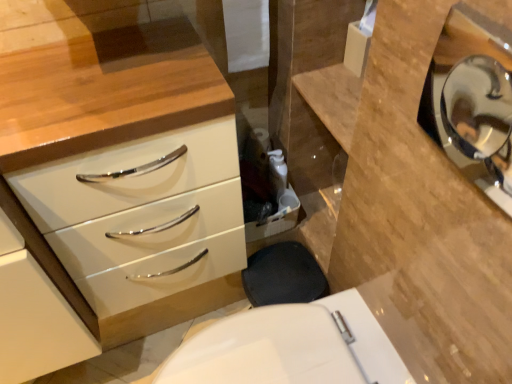
Measure the distance between white glossy toilet at lower center and camera.

white glossy toilet at lower center and camera are 31.50 inches apart from each other.

Locate an element on the screen. The width and height of the screenshot is (512, 384). white glossy chest of drawers at left is located at coordinates (123, 156).

At what (x,y) coordinates should I click in order to perform the action: click on white glossy toilet at lower center. Please return your answer as a coordinate pair (x, y). The height and width of the screenshot is (384, 512). Looking at the image, I should click on (291, 347).

From the image's perspective, which object appears higher, white glossy chest of drawers at left or white glossy toilet at lower center?

white glossy chest of drawers at left, from the image's perspective.

Which of these two, white glossy chest of drawers at left or white glossy toilet at lower center, stands shorter?

white glossy toilet at lower center is shorter.

Is white glossy chest of drawers at left further to camera compared to white glossy toilet at lower center?

No, it is not.

Is white glossy chest of drawers at left inside or outside of white glossy toilet at lower center?

white glossy chest of drawers at left is located beyond the bounds of white glossy toilet at lower center.

Is white glossy toilet at lower center bigger than white glossy chest of drawers at left?

Actually, white glossy toilet at lower center might be smaller than white glossy chest of drawers at left.

Which is more to the right, white glossy toilet at lower center or white glossy chest of drawers at left?

From the viewer's perspective, white glossy toilet at lower center appears more on the right side.

Which is in front, white glossy toilet at lower center or white glossy chest of drawers at left?

white glossy chest of drawers at left.

From a real-world perspective, who is located higher, white glossy toilet at lower center or white glossy chest of drawers at left?

white glossy chest of drawers at left.

From the picture: Is polished silver mirror at upper right a part of white glossy toilet at lower center?

No, white glossy toilet at lower center does not contain polished silver mirror at upper right.

Is white glossy toilet at lower center oriented towards polished silver mirror at upper right?

No, white glossy toilet at lower center is not facing towards polished silver mirror at upper right.

Which is less distant, (313,322) or (434,110)?

Point (313,322) appears to be closer to the viewer than point (434,110).

Considering the sizes of white glossy toilet at lower center and polished silver mirror at upper right in the image, is white glossy toilet at lower center wider or thinner than polished silver mirror at upper right?

Considering their sizes, white glossy toilet at lower center looks broader than polished silver mirror at upper right.

From the image's perspective, is white glossy chest of drawers at left beneath polished silver mirror at upper right?

Indeed, from the image's perspective, white glossy chest of drawers at left is shown beneath polished silver mirror at upper right.

Is the depth of white glossy chest of drawers at left less than that of polished silver mirror at upper right?

No, white glossy chest of drawers at left is behind polished silver mirror at upper right.

Which of these two, white glossy chest of drawers at left or polished silver mirror at upper right, is wider?

white glossy chest of drawers at left.

Which point is more distant from viewer, [115,307] or [447,116]?

The point [115,307] is farther from the camera.

Can you tell me how much polished silver mirror at upper right and white glossy chest of drawers at left differ in facing direction?

polished silver mirror at upper right and white glossy chest of drawers at left are facing 88.4 degrees away from each other.

From a real-world perspective, which is physically above, polished silver mirror at upper right or white glossy chest of drawers at left?

polished silver mirror at upper right is physically above.

Considering the relative positions of polished silver mirror at upper right and white glossy chest of drawers at left in the image provided, is polished silver mirror at upper right to the left of white glossy chest of drawers at left from the viewer's perspective?

No.

This screenshot has height=384, width=512. What are the coordinates of `medicine cabinet that is on the right side of white glossy chest of drawers at left` in the screenshot? It's located at (470, 96).

Would you say polished silver mirror at upper right is inside or outside white glossy toilet at lower center?

polished silver mirror at upper right is spatially situated outside white glossy toilet at lower center.

Can you see polished silver mirror at upper right touching white glossy toilet at lower center?

polished silver mirror at upper right and white glossy toilet at lower center are clearly separated.

Is point (463, 147) positioned behind point (297, 307)?

Yes, it is.

The image size is (512, 384). What are the coordinates of `toilet behind the white glossy chest of drawers at left` in the screenshot? It's located at (291, 347).

Image resolution: width=512 pixels, height=384 pixels. Find the location of `chest of drawers in front of the white glossy toilet at lower center`. chest of drawers in front of the white glossy toilet at lower center is located at coordinates (123, 156).

Considering their positions, is white glossy chest of drawers at left positioned further to white glossy toilet at lower center than polished silver mirror at upper right?

Among the two, polished silver mirror at upper right is located further to white glossy toilet at lower center.

From the image, which object appears to be farther from polished silver mirror at upper right, white glossy toilet at lower center or white glossy chest of drawers at left?

Based on the image, white glossy chest of drawers at left appears to be further to polished silver mirror at upper right.

When comparing their distances from white glossy toilet at lower center, does polished silver mirror at upper right or white glossy chest of drawers at left seem further?

Among the two, polished silver mirror at upper right is located further to white glossy toilet at lower center.

Based on their spatial positions, is white glossy chest of drawers at left or white glossy toilet at lower center further from polished silver mirror at upper right?

white glossy chest of drawers at left is positioned further to the anchor polished silver mirror at upper right.

Looking at the image, which one is located further to white glossy chest of drawers at left, polished silver mirror at upper right or white glossy toilet at lower center?

polished silver mirror at upper right.

Which object lies further to the anchor point white glossy chest of drawers at left, white glossy toilet at lower center or polished silver mirror at upper right?

polished silver mirror at upper right.

The image size is (512, 384). In order to click on toilet between white glossy chest of drawers at left and polished silver mirror at upper right from left to right in this screenshot , I will do `click(291, 347)`.